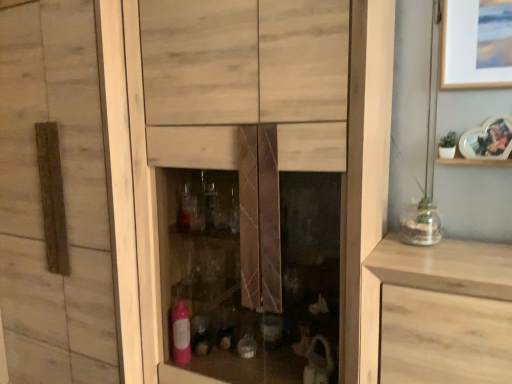
Question: Is wooden shelf at upper right at the back of heart-shaped photo frame at upper right?

Choices:
 (A) yes
 (B) no

Answer: (B)

Question: Does heart-shaped photo frame at upper right have a larger size compared to wooden shelf at upper right?

Choices:
 (A) yes
 (B) no

Answer: (A)

Question: Is heart-shaped photo frame at upper right to the left of wooden shelf at upper right from the viewer's perspective?

Choices:
 (A) no
 (B) yes

Answer: (A)

Question: From the image's perspective, does heart-shaped photo frame at upper right appear lower than wooden shelf at upper right?

Choices:
 (A) yes
 (B) no

Answer: (B)

Question: Does heart-shaped photo frame at upper right lie in front of wooden shelf at upper right?

Choices:
 (A) no
 (B) yes

Answer: (B)

Question: Is heart-shaped photo frame at upper right in front of or behind wooden shelf at upper right in the image?

Choices:
 (A) front
 (B) behind

Answer: (A)

Question: Does point (487, 155) appear closer or farther from the camera than point (454, 158)?

Choices:
 (A) farther
 (B) closer

Answer: (B)

Question: Is heart-shaped photo frame at upper right taller or shorter than wooden shelf at upper right?

Choices:
 (A) short
 (B) tall

Answer: (B)

Question: Based on their positions, is heart-shaped photo frame at upper right located to the left or right of wooden shelf at upper right?

Choices:
 (A) left
 (B) right

Answer: (B)

Question: Considering the positions of point (412, 243) and point (438, 314), is point (412, 243) closer or farther from the camera than point (438, 314)?

Choices:
 (A) farther
 (B) closer

Answer: (A)

Question: In the image, is clear glass vase at right on the left side or the right side of light wood drawer at right?

Choices:
 (A) right
 (B) left

Answer: (B)

Question: Considering the positions of clear glass vase at right and light wood drawer at right in the image, is clear glass vase at right taller or shorter than light wood drawer at right?

Choices:
 (A) short
 (B) tall

Answer: (A)

Question: Is clear glass vase at right situated inside light wood drawer at right or outside?

Choices:
 (A) outside
 (B) inside

Answer: (A)

Question: Considering the positions of light wood drawer at right and clear glass vase at right in the image, is light wood drawer at right wider or thinner than clear glass vase at right?

Choices:
 (A) wide
 (B) thin

Answer: (A)

Question: Is light wood drawer at right bigger or smaller than clear glass vase at right?

Choices:
 (A) big
 (B) small

Answer: (A)